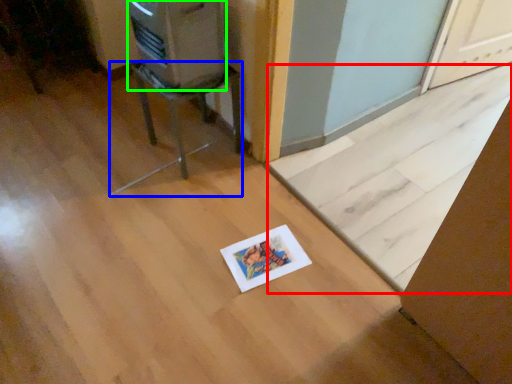
Question: Which object is positioned farthest from doormat (highlighted by a red box)? Select from furniture (highlighted by a blue box) and appliance (highlighted by a green box).

Choices:
 (A) furniture
 (B) appliance

Answer: (B)